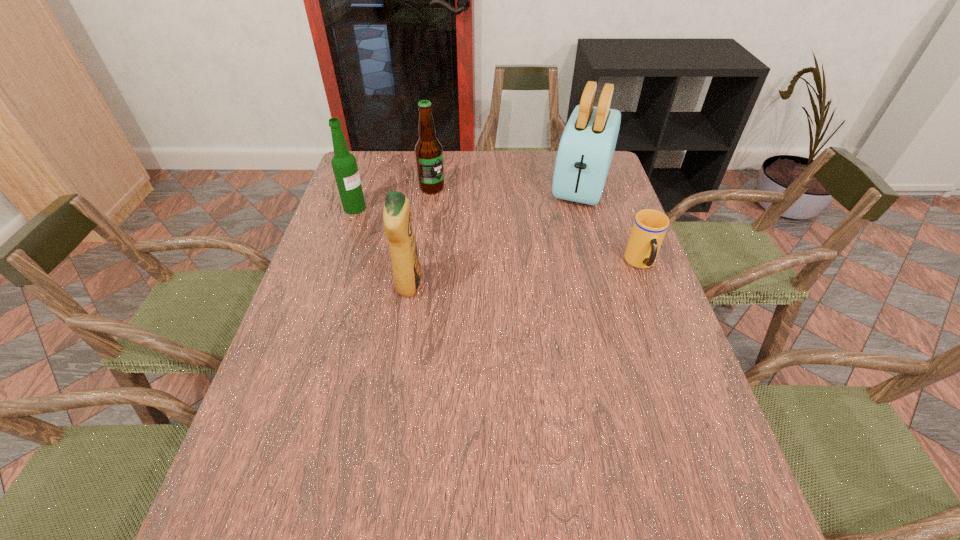
Image resolution: width=960 pixels, height=540 pixels. I want to click on vacant space situated 0.220m on the side of the toaster with the lever, so click(x=562, y=254).

The image size is (960, 540). In order to click on vacant space positioned on the label of the right beer bottle in this screenshot , I will do `click(466, 219)`.

Locate an element on the screen. free location located on the label of the right beer bottle is located at coordinates (455, 209).

Where is `free spot located on the label of the right beer bottle`? free spot located on the label of the right beer bottle is located at coordinates tap(502, 252).

At what (x,y) coordinates should I click in order to perform the action: click on vacant region located 0.100m on the label of the nearer beer bottle. Please return your answer as a coordinate pair (x, y). This screenshot has height=540, width=960. Looking at the image, I should click on (388, 221).

Locate an element on the screen. This screenshot has height=540, width=960. free location located on the label of the nearer beer bottle is located at coordinates (380, 219).

You are a GUI agent. You are given a task and a screenshot of the screen. Output one action in this format:
    pyautogui.click(x=<x>, y=<y>)
    Task: Click on the free space located on the label of the nearer beer bottle
    
    Given the screenshot: What is the action you would take?
    pyautogui.click(x=406, y=229)

Where is `toaster located at the far edge`? toaster located at the far edge is located at coordinates (587, 145).

The image size is (960, 540). I want to click on beer bottle present at the far edge, so click(x=428, y=150).

This screenshot has width=960, height=540. I want to click on object located at the left edge, so click(344, 164).